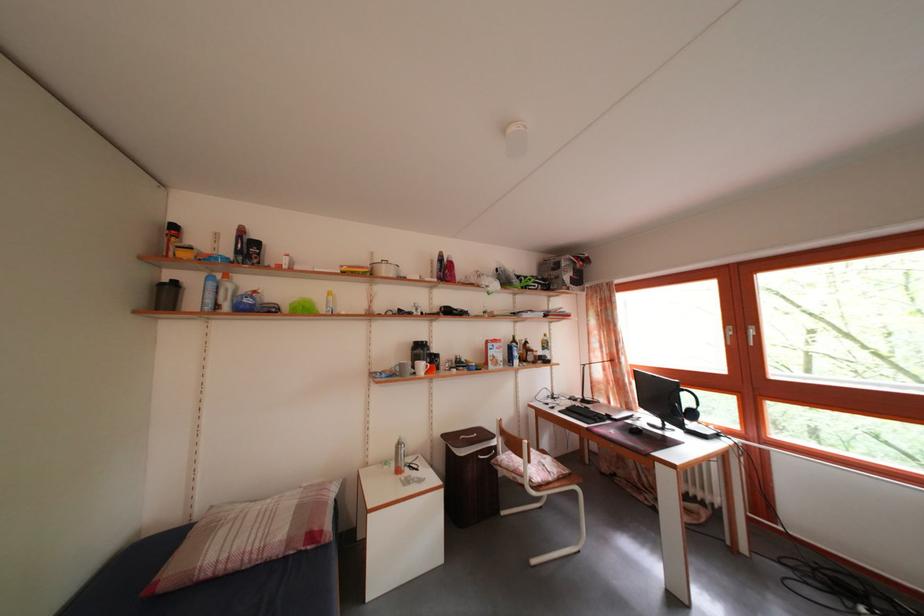
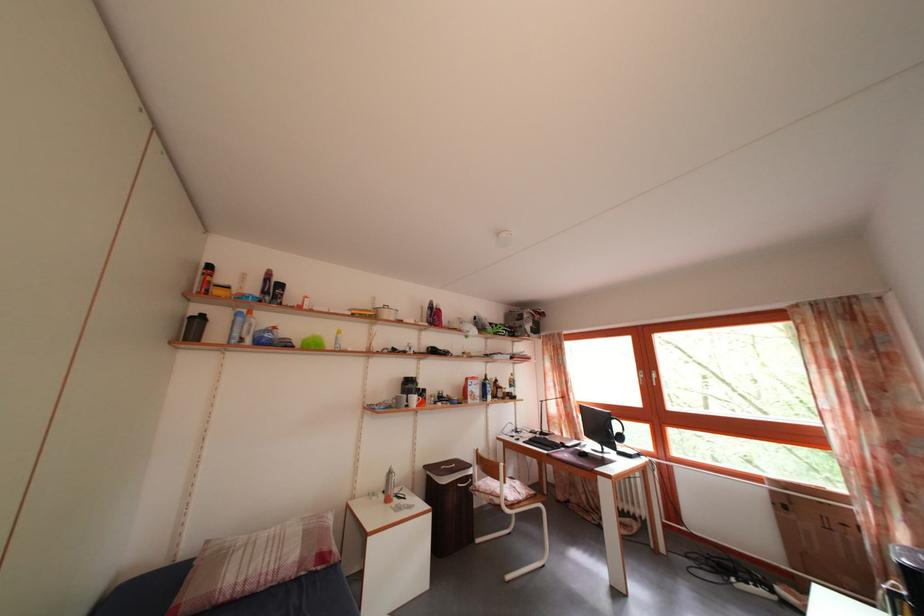
Where in the second image is the point corresponding to [591,408] from the first image?

(550, 440)